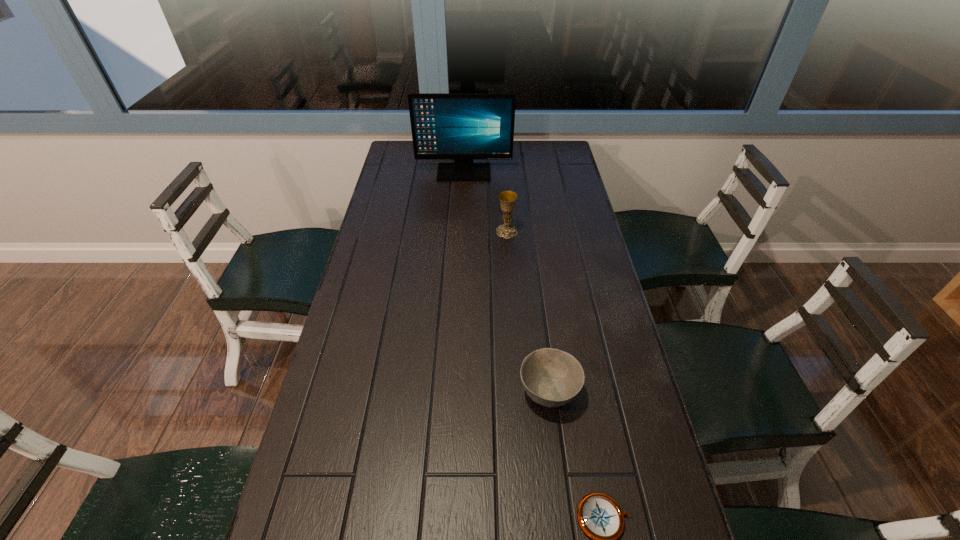
Where is `object present at the left edge`? Image resolution: width=960 pixels, height=540 pixels. object present at the left edge is located at coordinates (463, 127).

The height and width of the screenshot is (540, 960). I want to click on object located in the right edge section of the desktop, so click(551, 377).

Where is `object at the far left corner`? The width and height of the screenshot is (960, 540). object at the far left corner is located at coordinates (463, 127).

Image resolution: width=960 pixels, height=540 pixels. Find the location of `vacant area at the far edge of the desktop`. vacant area at the far edge of the desktop is located at coordinates (517, 143).

Where is `vacant space at the left edge of the desktop`? vacant space at the left edge of the desktop is located at coordinates (403, 298).

Where is `free space at the right edge of the desktop`? free space at the right edge of the desktop is located at coordinates (604, 341).

Locate an element on the screen. Image resolution: width=960 pixels, height=540 pixels. vacant area at the far left corner is located at coordinates (416, 168).

Where is `vacant space at the far right corner of the desktop`? This screenshot has width=960, height=540. vacant space at the far right corner of the desktop is located at coordinates (542, 159).

The height and width of the screenshot is (540, 960). Find the location of `free space between the second nearest object and the third shortest object`. free space between the second nearest object and the third shortest object is located at coordinates (528, 312).

Locate an element on the screen. The width and height of the screenshot is (960, 540). free space between the tallest object and the second farthest object is located at coordinates click(x=486, y=202).